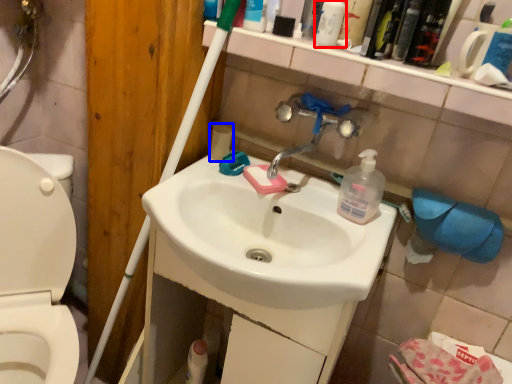
Question: Which of the following is the closest to the observer, cleaning product (highlighted by a red box) or toilet paper (highlighted by a blue box)?

Choices:
 (A) cleaning product
 (B) toilet paper

Answer: (A)